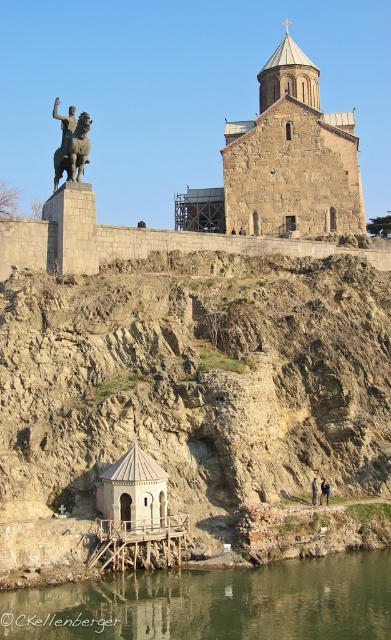
You are a tourist visiting the historical site and want to take a photo that includes both the greenish water at lower center and the brown stone church at upper center. Based on their widths, which object should you frame first to ensure both are visible in the photo?

The greenish water at lower center has a lesser width compared to the brown stone church at upper center, so you should frame the brown stone church at upper center first to accommodate its larger width in the photo.

You are a hiker who wants to climb the brown rocky hillside at center. You have a brown leather jacket at lower center. Can you wear the jacket while climbing?

The brown rocky hillside at center might be wider than brown leather jacket at lower center, so you can wear the jacket while climbing.